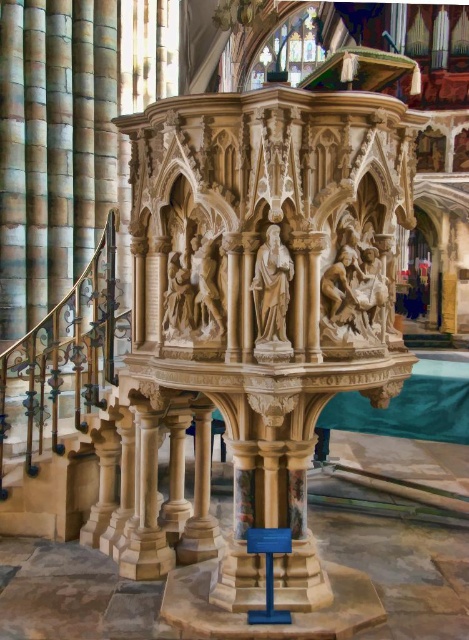
Is point (378, 256) more distant than point (259, 288)?

Yes.

You are a GUI agent. You are given a task and a screenshot of the screen. Output one action in this format:
    pyautogui.click(x=<x>, y=<y>)
    Task: Click on the polished stone relief at center
    The width and height of the screenshot is (469, 640).
    Given the screenshot: What is the action you would take?
    pyautogui.click(x=353, y=289)